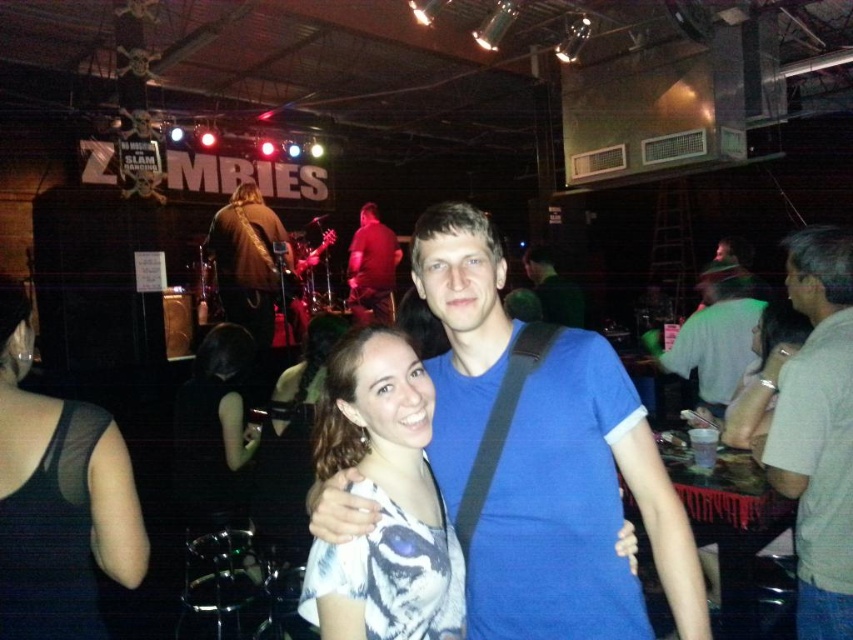
Consider the image. You are at a concert and want to take a photo of the two points mentioned. Which point is closer to you, point (607, 612) or point (376, 212)?

Point (607, 612) is closer to the viewer than point (376, 212).

You are at a concert venue where the stage backdrop says ZOMBIES. You see two people in front of you. The person on the left has long brown hair and a light top. The person on the right has short brown hair. There is a point marked at coordinates [289,448]. What is located at that point?

At point [289,448] lies dark brown hair at center.